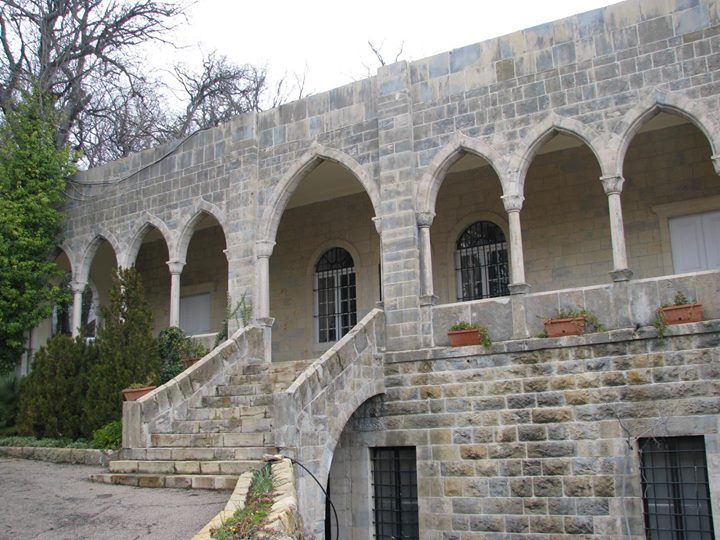
Identify the location of door. (693, 247), (214, 306).